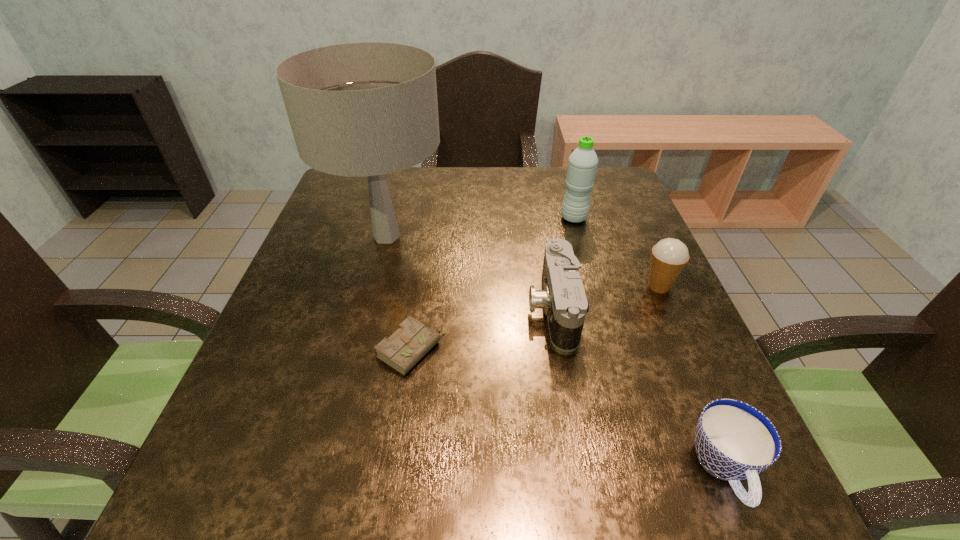
At what (x,y) coordinates should I click in order to perform the action: click on free space that is in between the water bottle and the shortest object. Please return your answer as a coordinate pair (x, y). This screenshot has height=540, width=960. Looking at the image, I should click on (492, 284).

Find the location of a particular element. free space between the lampshade and the icecream is located at coordinates (522, 261).

At what (x,y) coordinates should I click in order to perform the action: click on empty space between the camera and the icecream. Please return your answer as a coordinate pair (x, y). This screenshot has width=960, height=540. Looking at the image, I should click on (606, 298).

Where is `free spot between the lampshade and the fourth object from right to left`? free spot between the lampshade and the fourth object from right to left is located at coordinates (469, 272).

Identify the location of free space between the shortest object and the lampshade. (398, 293).

Locate an element on the screen. The height and width of the screenshot is (540, 960). empty space that is in between the water bottle and the icecream is located at coordinates (616, 252).

What are the coordinates of `blank region between the fourth tallest object and the nearest object` in the screenshot? It's located at (638, 389).

Image resolution: width=960 pixels, height=540 pixels. Identify the location of vacant area that lies between the lampshade and the nearest object. tap(556, 353).

Where is `free space between the diary and the third shortest object`? The width and height of the screenshot is (960, 540). free space between the diary and the third shortest object is located at coordinates coord(482,329).

Identify which object is located as the second nearest to the water bottle. Please provide its 2D coordinates. Your answer should be formatted as a tuple, i.e. [(x, y)], where the tuple contains the x and y coordinates of a point satisfying the conditions above.

[(669, 256)]